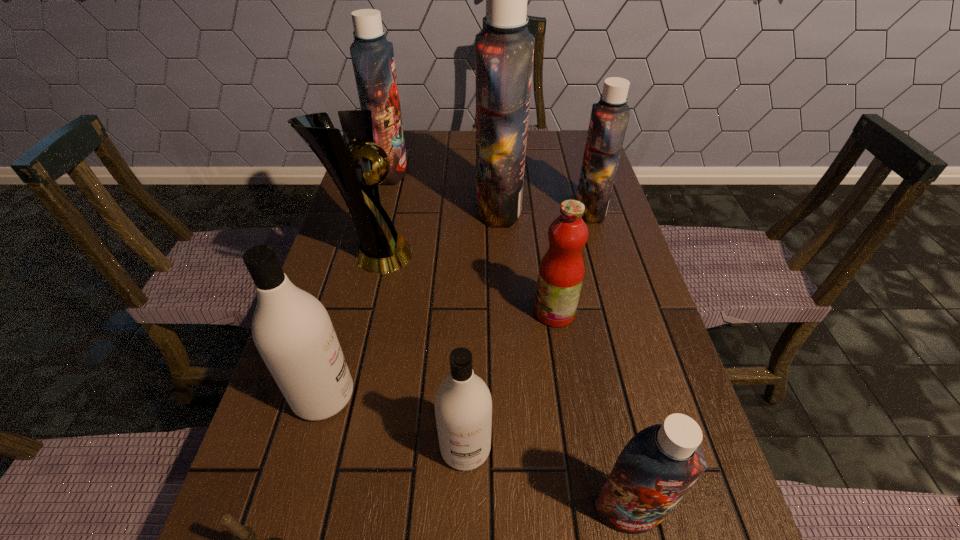
At what (x,y) coordinates should I click in order to perform the action: click on the biggest blue shampoo. Please return your answer as a coordinate pair (x, y). This screenshot has width=960, height=540. Looking at the image, I should click on (504, 50).

Where is `the tallest object`? the tallest object is located at coordinates (x=504, y=50).

Find the location of a particular element. Image resolution: width=960 pixels, height=540 pixels. the leftmost blue shampoo is located at coordinates (372, 55).

Find the location of a particular element. the third smallest blue shampoo is located at coordinates (372, 55).

I want to click on award, so tap(355, 169).

At what (x,y) coordinates should I click in order to perform the action: click on the second smallest blue shampoo. Please return your answer as a coordinate pair (x, y). Looking at the image, I should click on (609, 118).

Locate an element on the screen. the bigger white shampoo is located at coordinates (292, 330).

Where is `fruit juice`? Image resolution: width=960 pixels, height=540 pixels. fruit juice is located at coordinates point(561,271).

Locate an element on the screen. The width and height of the screenshot is (960, 540). pink fruit juice is located at coordinates (561, 271).

Identify the location of the eighth farthest object. The image size is (960, 540). (656, 468).